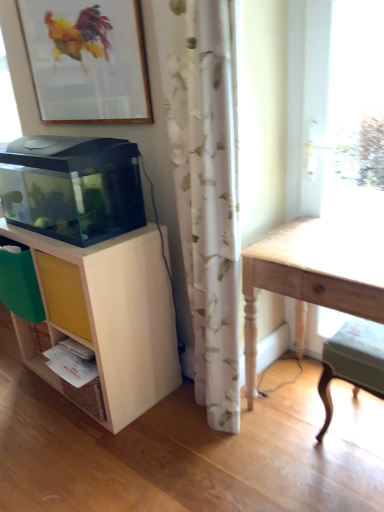
Question: Considering their positions, is light green fabric step stool at lower right located in front of or behind transparent glass aquarium at left?

Choices:
 (A) behind
 (B) front

Answer: (B)

Question: From the image's perspective, is light green fabric step stool at lower right located above or below transparent glass aquarium at left?

Choices:
 (A) above
 (B) below

Answer: (B)

Question: Which is farther from the matte wood shelf at left?

Choices:
 (A) light wood table at right
 (B) yellow matte drawer at lower left
 (C) light green fabric step stool at lower right
 (D) transparent glass aquarium at left
 (E) wooden framed picture at upper left

Answer: (C)

Question: Estimate the real-world distances between objects in this image. Which object is closer to the light green fabric step stool at lower right?

Choices:
 (A) matte wood shelf at left
 (B) white floral curtain at center
 (C) yellow matte drawer at lower left
 (D) transparent glass aquarium at left
 (E) wooden framed picture at upper left

Answer: (B)